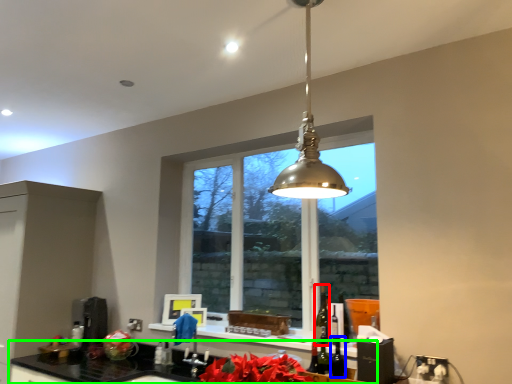
Question: Considering the real-world distances, which object is farthest from alcohol (highlighted by a red box)? wine (highlighted by a blue box) or countertop (highlighted by a green box)?

Choices:
 (A) wine
 (B) countertop

Answer: (B)